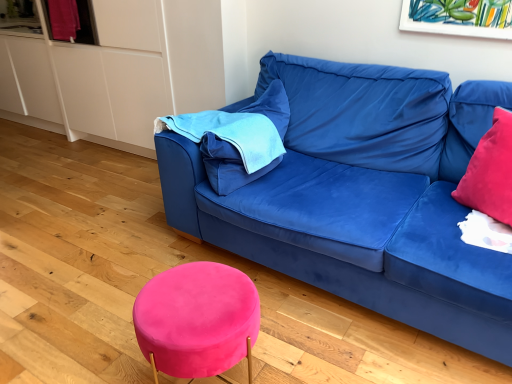
Question: From the image's perspective, is velvet red pillow at right above or below velvet pink stool at lower center?

Choices:
 (A) below
 (B) above

Answer: (B)

Question: From a real-world perspective, is velvet red pillow at right physically located above or below velvet pink stool at lower center?

Choices:
 (A) above
 (B) below

Answer: (A)

Question: Based on their relative distances, which object is farther from the blue fabric pillow at upper left?

Choices:
 (A) velvet pink stool at lower center
 (B) velvet red pillow at right
 (C) velvet blue couch at center

Answer: (B)

Question: Estimate the real-world distances between objects in this image. Which object is farther from the blue fabric pillow at upper left?

Choices:
 (A) velvet blue couch at center
 (B) velvet red pillow at right
 (C) velvet pink stool at lower center

Answer: (B)